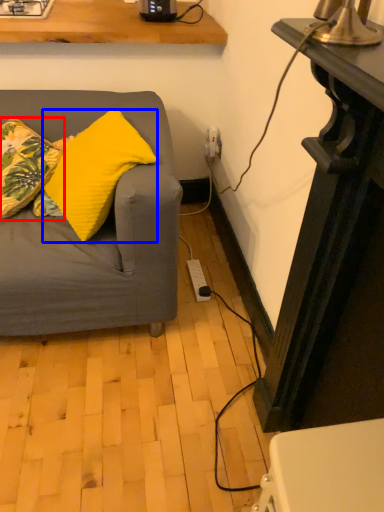
Question: Which object is further to the camera taking this photo, pillow (highlighted by a red box) or pillow (highlighted by a blue box)?

Choices:
 (A) pillow
 (B) pillow

Answer: (A)